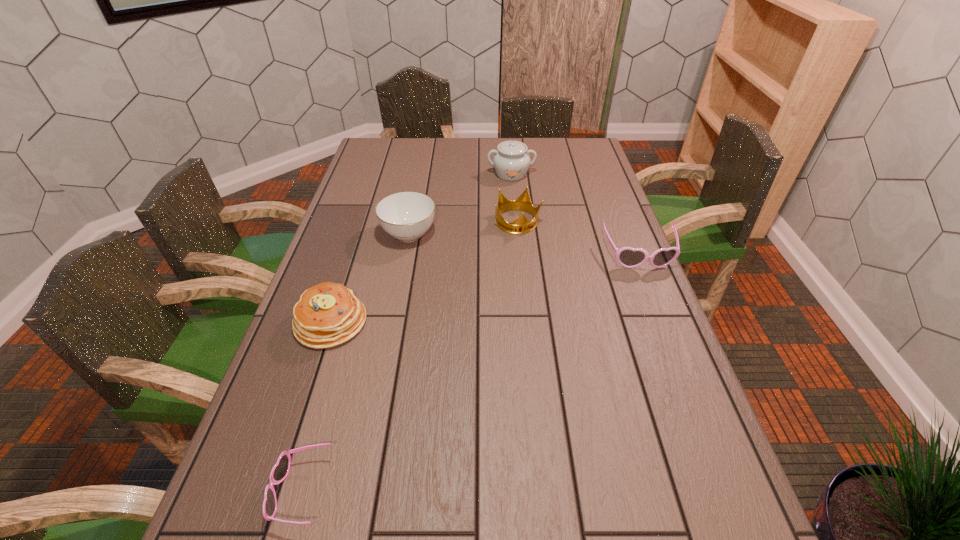
If equal spacing is desired by inserting an extra sunglasses among them, please point out a free spot for this new sunglasses. Please provide its 2D coordinates. Your answer should be formatted as a tuple, i.e. [(x, y)], where the tuple contains the x and y coordinates of a point satisfying the conditions above.

[(509, 346)]